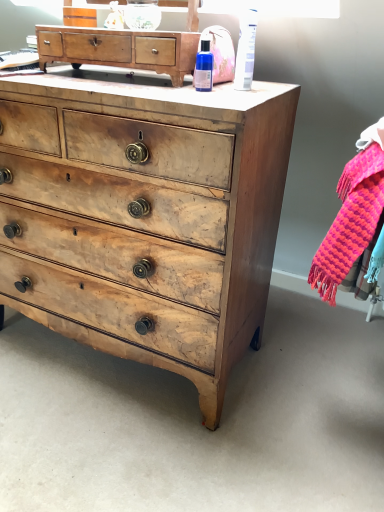
Locate an element on the screen. This screenshot has height=512, width=384. free space in front of wooden chest of drawers at center, which is the 2th chest of drawers from top to bottom is located at coordinates (120, 438).